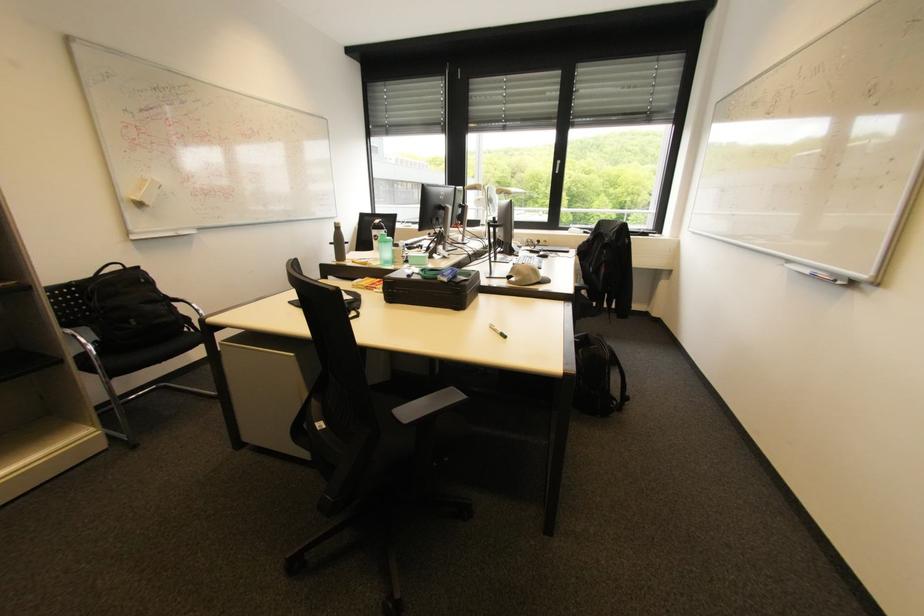
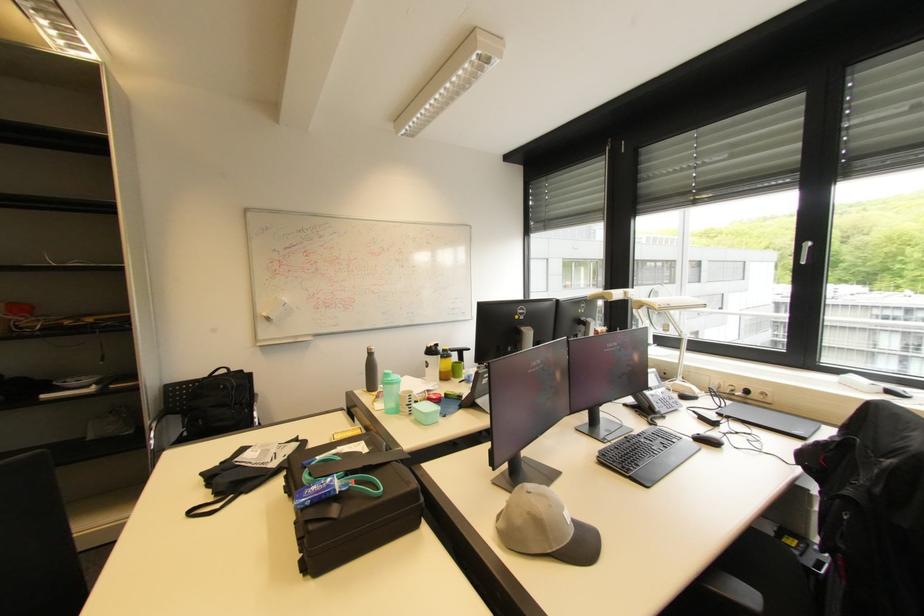
In the second image, find the point that corresponds to the point at 341,225 in the first image.

(372, 350)